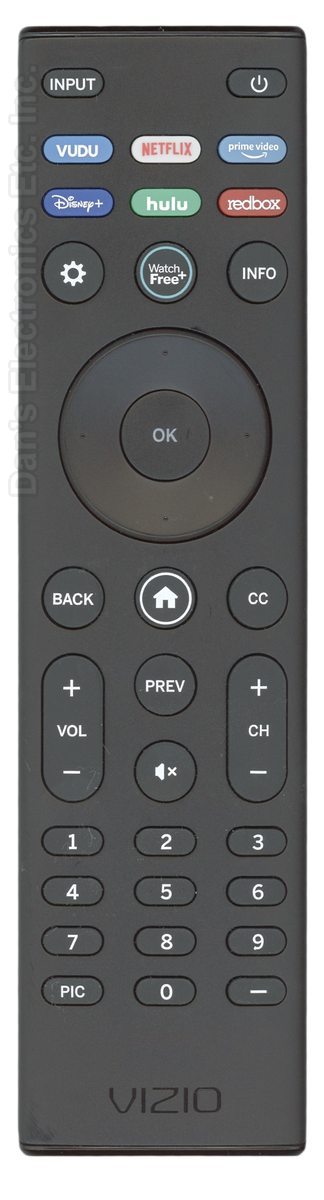
The height and width of the screenshot is (1200, 324). In order to click on remote number keys in this screenshot , I will do `click(76, 838)`, `click(176, 839)`, `click(249, 840)`, `click(250, 896)`, `click(161, 888)`, `click(75, 889)`, `click(74, 938)`, `click(171, 942)`, `click(261, 938)`, `click(157, 990)`.